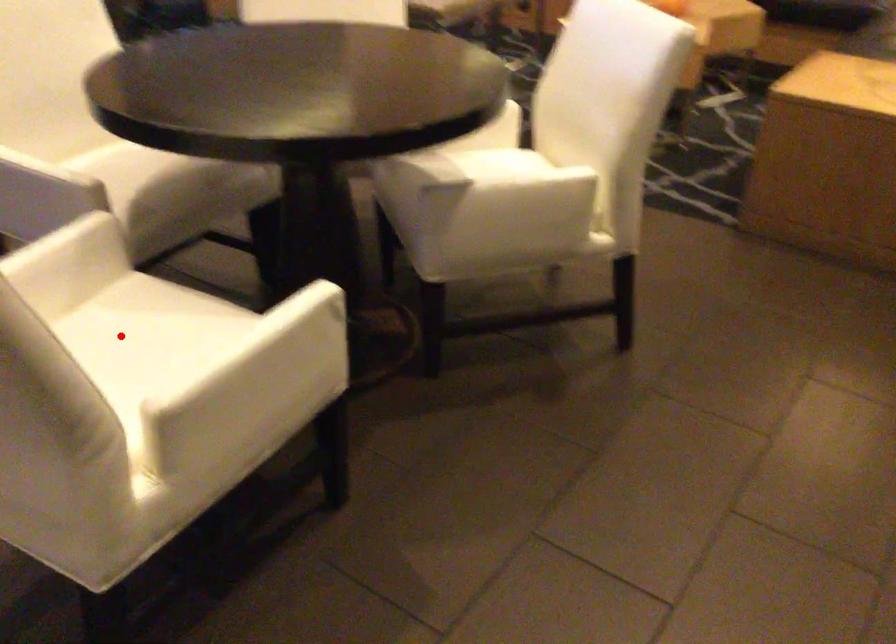
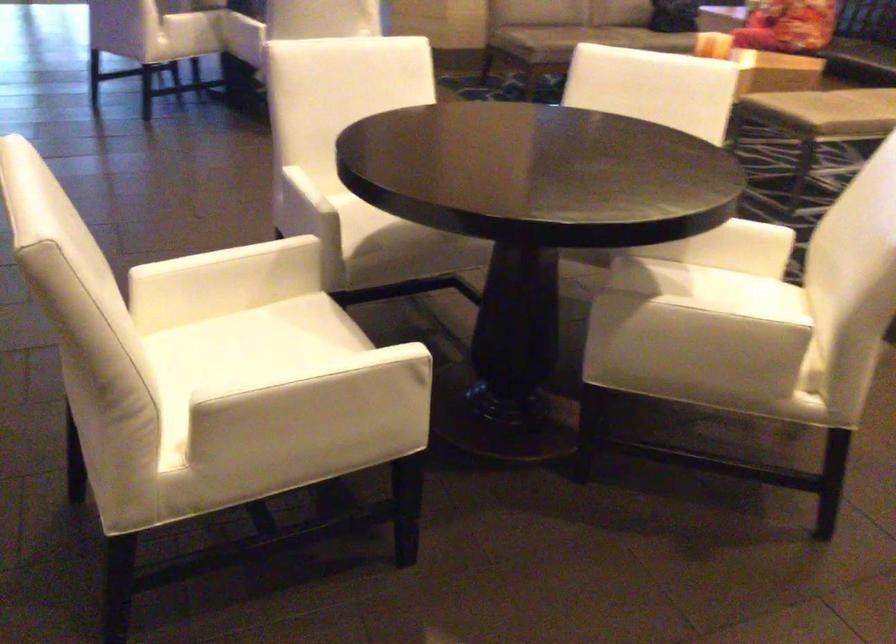
Question: I am providing you with two images of the same scene from different viewpoints. Image1 has a red point marked. In image2, the corresponding 3D location appears at what relative position? Reply with the corresponding letter.

Choices:
 (A) Closer
 (B) Farther

Answer: (B)